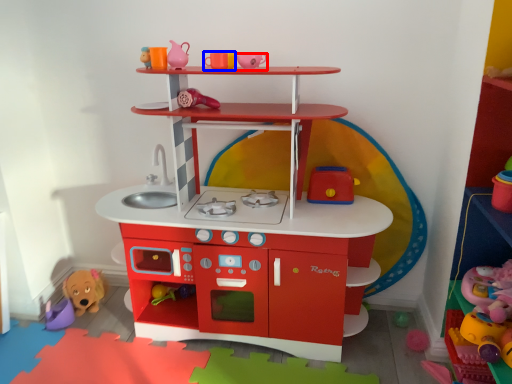
Question: Which object appears closest to the camera in this image, toy (highlighted by a red box) or toy (highlighted by a blue box)?

Choices:
 (A) toy
 (B) toy

Answer: (A)